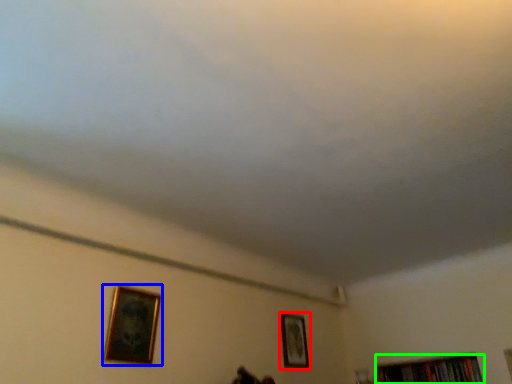
Question: Estimate the real-world distances between objects in this image. Which object is closer to picture frame (highlighted by a red box), picture frame (highlighted by a blue box) or book (highlighted by a green box)?

Choices:
 (A) picture frame
 (B) book

Answer: (B)